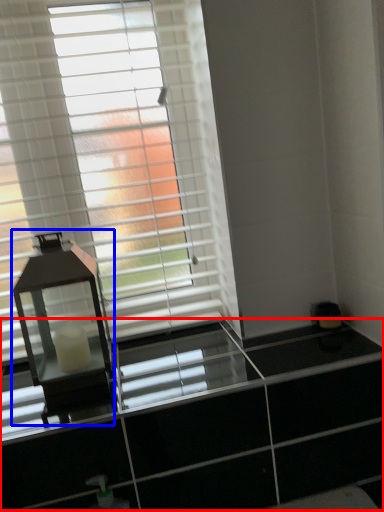
Question: Which object appears closest to the camera in this image, dresser (highlighted by a red box) or table lamp (highlighted by a blue box)?

Choices:
 (A) dresser
 (B) table lamp

Answer: (A)